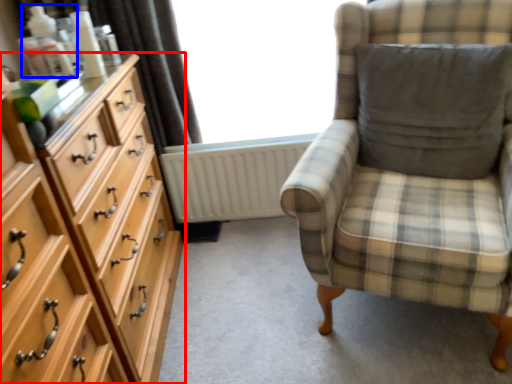
Question: Which point is further to the camera, chest of drawers (highlighted by a red box) or toiletry (highlighted by a blue box)?

Choices:
 (A) chest of drawers
 (B) toiletry

Answer: (B)